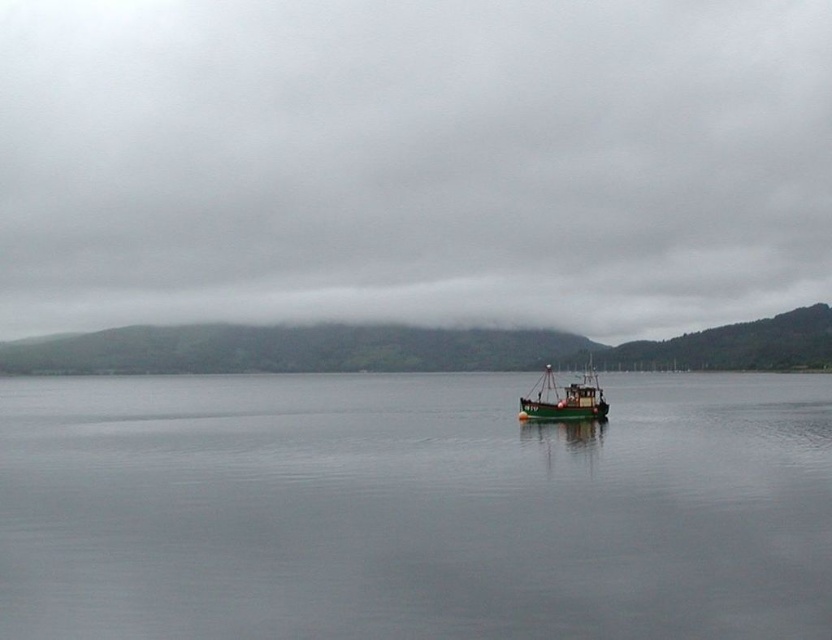
You are an observer looking at the cloudy sky at center and the green matte boat at center. Which object takes up more space in the image?

The cloudy sky at center has a larger size compared to the green matte boat at center, so it takes up more space in the image.

You are an artist planning to paint the scene. You want to ensure that the cloudy sky at center and the green matte water at center are proportionally accurate. Which object should you paint first to maintain the correct size relationship between them?

The cloudy sky at center should be painted first since it is larger in size than the green matte water at center, ensuring the correct proportion between them.